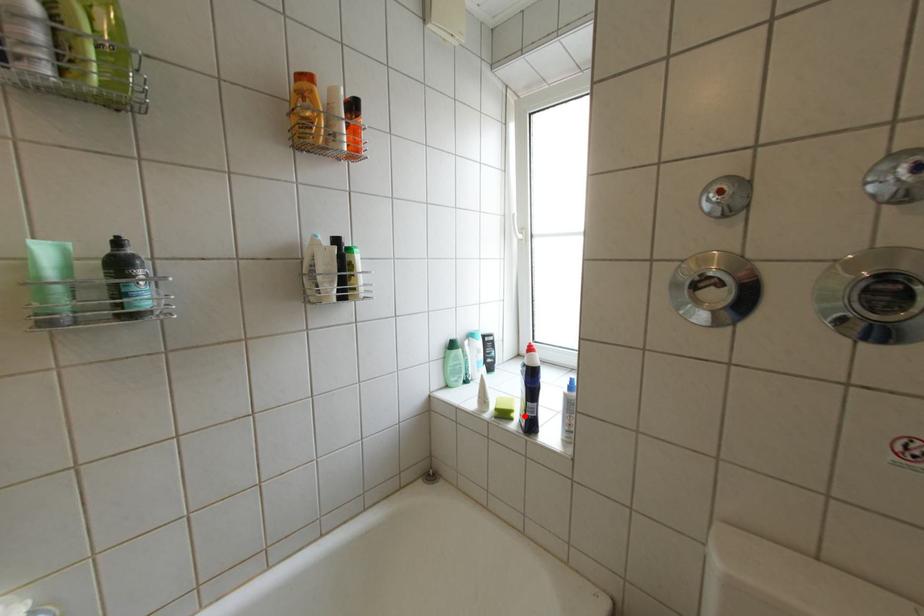
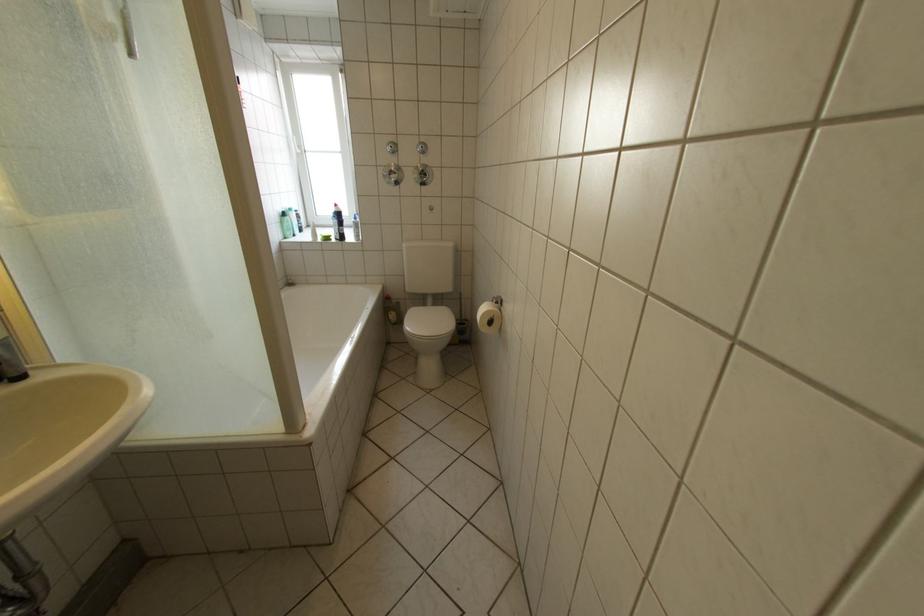
Where in the second image is the point corresponding to the highlighted location from the first image?

(344, 238)